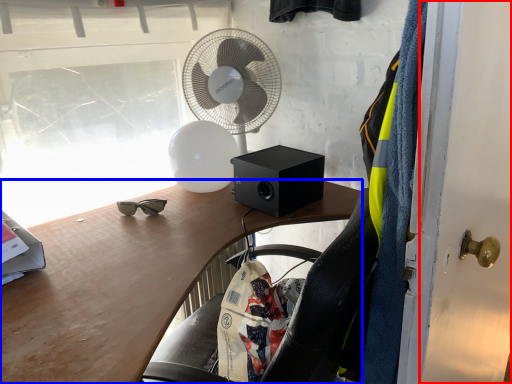
Question: Among these objects, which one is farthest to the camera, door (highlighted by a red box) or desk (highlighted by a blue box)?

Choices:
 (A) door
 (B) desk

Answer: (B)